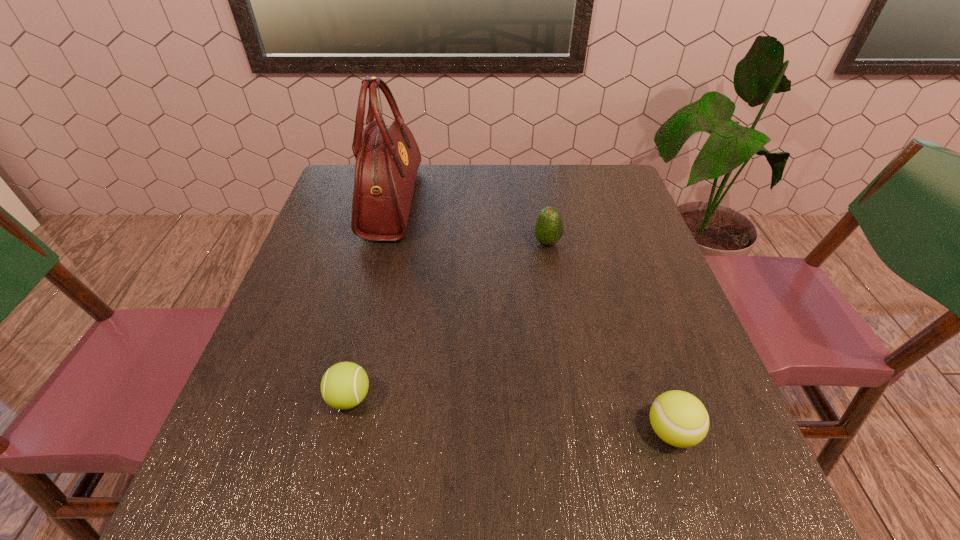
The image size is (960, 540). I want to click on vacant space that's between the left tennis ball and the rightmost object, so 510,415.

Identify the location of empty space that is in between the third shortest object and the left tennis ball. This screenshot has height=540, width=960. (448, 320).

Find the location of a particular element. The image size is (960, 540). vacant area that lies between the left tennis ball and the handbag is located at coordinates (371, 300).

Find the location of a particular element. This screenshot has width=960, height=540. free point between the left tennis ball and the handbag is located at coordinates (371, 300).

The width and height of the screenshot is (960, 540). I want to click on empty space between the tallest object and the left tennis ball, so click(x=371, y=300).

This screenshot has height=540, width=960. Identify the location of blank region between the rightmost object and the tallest object. (532, 317).

Where is `free space between the left tennis ball and the third object from left to right`? The height and width of the screenshot is (540, 960). free space between the left tennis ball and the third object from left to right is located at coordinates (448, 320).

Find the location of a particular element. This screenshot has width=960, height=540. free space between the handbag and the second tallest object is located at coordinates (469, 222).

Image resolution: width=960 pixels, height=540 pixels. I want to click on vacant point located between the right tennis ball and the avocado, so click(609, 337).

Identify which object is the second nearest to the third object from left to right. Please provide its 2D coordinates. Your answer should be formatted as a tuple, i.e. [(x, y)], where the tuple contains the x and y coordinates of a point satisfying the conditions above.

[(680, 419)]